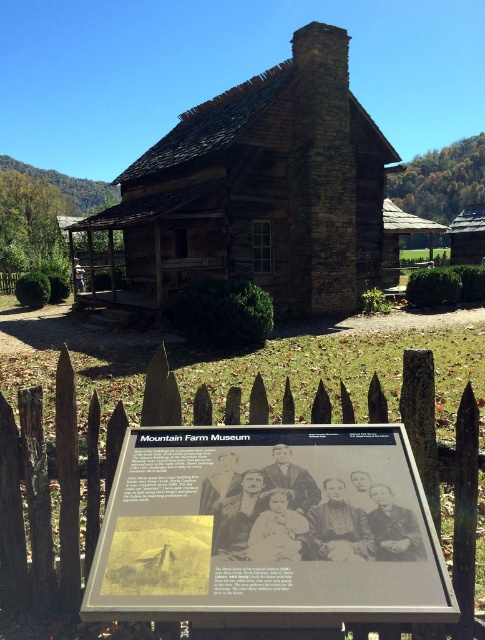
Question: In this image, where is rustic wood cabin at center located relative to brown wooden picket fence at lower left?

Choices:
 (A) below
 (B) above

Answer: (B)

Question: Which object is closer to the camera taking this photo?

Choices:
 (A) rustic wood cabin at center
 (B) brown wooden picket fence at lower left

Answer: (B)

Question: From the image, what is the correct spatial relationship of rustic wood cabin at center in relation to brown wooden picket fence at lower left?

Choices:
 (A) above
 (B) below

Answer: (A)

Question: Which of the following is the closest to the observer?

Choices:
 (A) (134, 218)
 (B) (404, 410)

Answer: (B)

Question: Observing the image, what is the correct spatial positioning of rustic wood cabin at center in reference to brown wooden picket fence at lower left?

Choices:
 (A) below
 (B) above

Answer: (B)